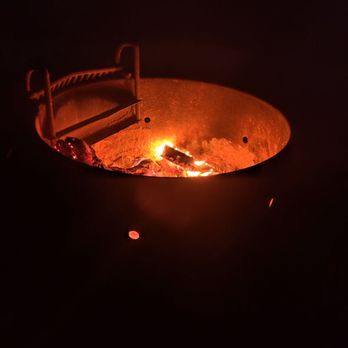
Where is `fire log`? fire log is located at coordinates (176, 153).